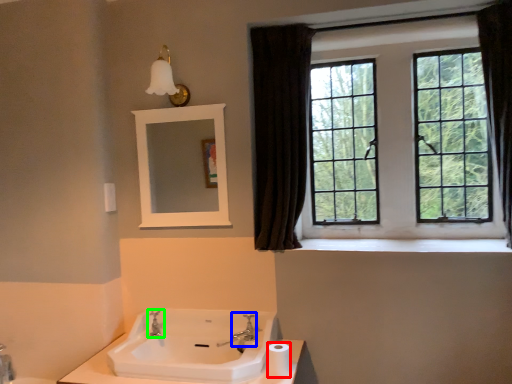
Question: Which is nearer to the toilet paper (highlighted by a red box)? plumbing fixture (highlighted by a blue box) or tap (highlighted by a green box).

Choices:
 (A) plumbing fixture
 (B) tap

Answer: (A)